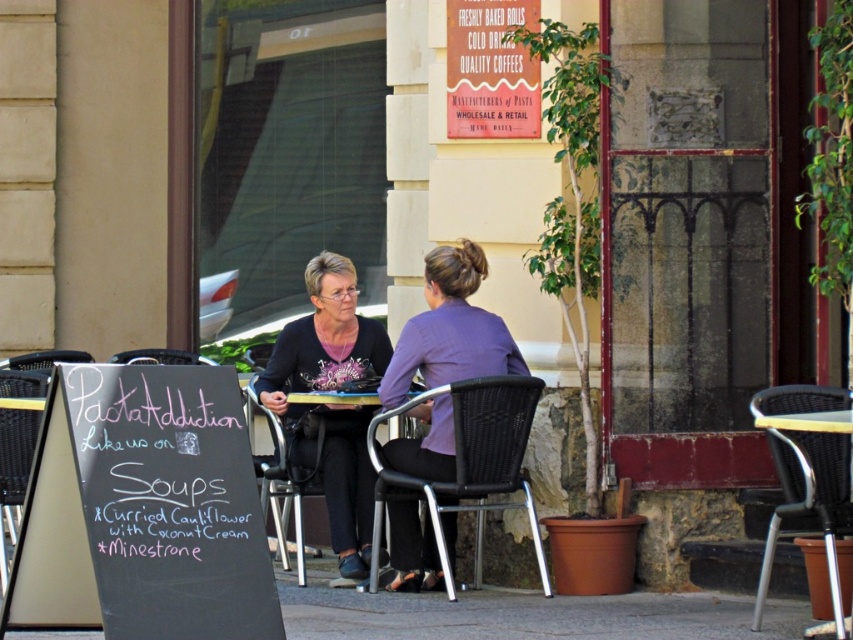
You are standing at the outdoor cafe and want to take a photo of both the menu board and one of the black plastic chairs. The menu board is at point (526, 417) and the chair is at point (10, 408). Which point should you focus on first to ensure both are in focus?

You should focus on point (526, 417) first because it is closer to the camera than point (10, 408), ensuring both are within the depth of field.